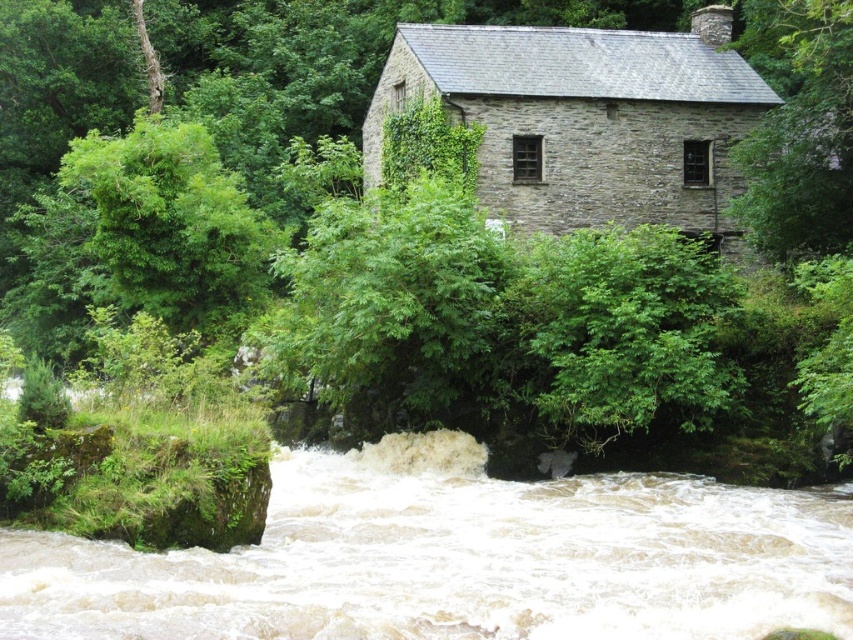
Is white frothy water at lower center shorter than green leafy tree at center?

Indeed, white frothy water at lower center has a lesser height compared to green leafy tree at center.

Does white frothy water at lower center have a smaller size compared to green leafy tree at center?

Yes.

Who is more distant from viewer, (585, 540) or (264, 52)?

Point (264, 52)

Where is `white frothy water at lower center`? white frothy water at lower center is located at coordinates (457, 557).